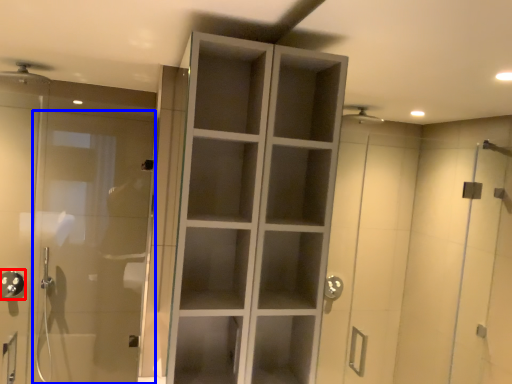
Question: Which object is closer to the camera taking this photo, shower (highlighted by a red box) or door (highlighted by a blue box)?

Choices:
 (A) shower
 (B) door

Answer: (B)